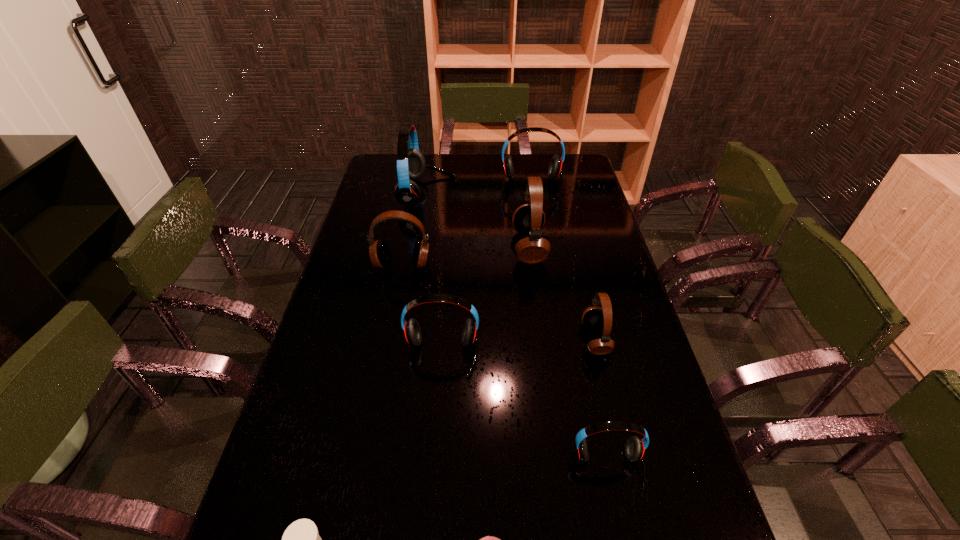
The height and width of the screenshot is (540, 960). Identify the location of free space between the rightmost black headset and the second biggest red headset. 564,262.

The width and height of the screenshot is (960, 540). I want to click on empty space that is in between the second biggest red headset and the biggest red headset, so click(480, 190).

Where is `object that is the second closest to the rightmost black headset`? object that is the second closest to the rightmost black headset is located at coordinates (635, 447).

Locate which object is the third closest to the biggest red headset. Please provide its 2D coordinates. Your answer should be formatted as a tuple, i.e. [(x, y)], where the tuple contains the x and y coordinates of a point satisfying the conditions above.

[(380, 255)]

At what (x,y) coordinates should I click in order to perform the action: click on the fourth closest headset to the medicine. Please return your answer as a coordinate pair (x, y). This screenshot has width=960, height=540. Looking at the image, I should click on (380, 255).

Image resolution: width=960 pixels, height=540 pixels. Identify the location of the closest headset to the rightmost black headset. (528, 219).

You are a GUI agent. You are given a task and a screenshot of the screen. Output one action in this format:
    pyautogui.click(x=<x>, y=<y>)
    Task: Click on the red headset that stands as the third closest to the third smallest red headset
    
    Given the screenshot: What is the action you would take?
    pyautogui.click(x=635, y=447)

Locate an element on the screen. the third closest red headset to the cupcake is located at coordinates (411, 164).

Select which black headset is the third closest to the biggest red headset. Please provide its 2D coordinates. Your answer should be formatted as a tuple, i.e. [(x, y)], where the tuple contains the x and y coordinates of a point satisfying the conditions above.

[(593, 317)]

Locate which black headset ranks third in proximity to the biggest red headset. Please provide its 2D coordinates. Your answer should be formatted as a tuple, i.e. [(x, y)], where the tuple contains the x and y coordinates of a point satisfying the conditions above.

[(593, 317)]